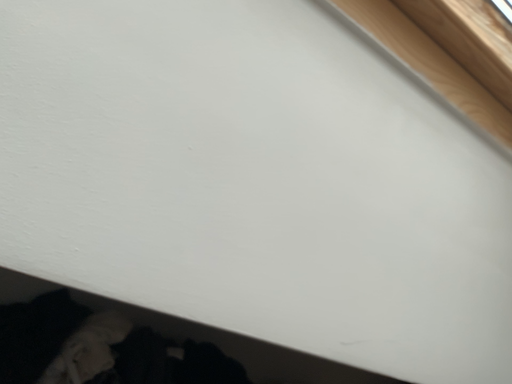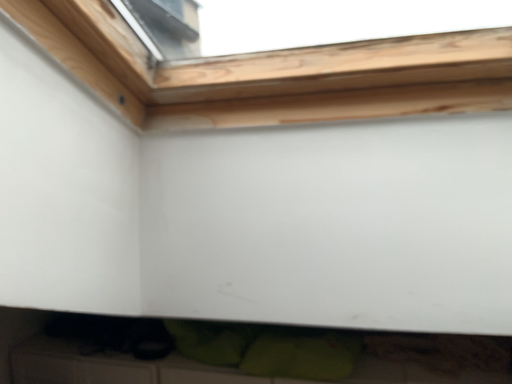
Question: Which way did the camera rotate in the video?

Choices:
 (A) rotated downward
 (B) rotated upward

Answer: (A)